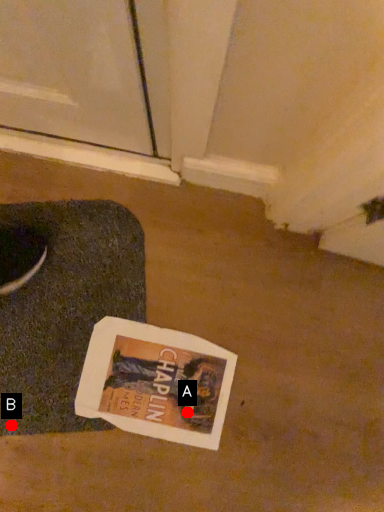
Question: Two points are circled on the image, labeled by A and B beside each circle. Which of the following is the farthest from the observer?

Choices:
 (A) A is further
 (B) B is further

Answer: (A)